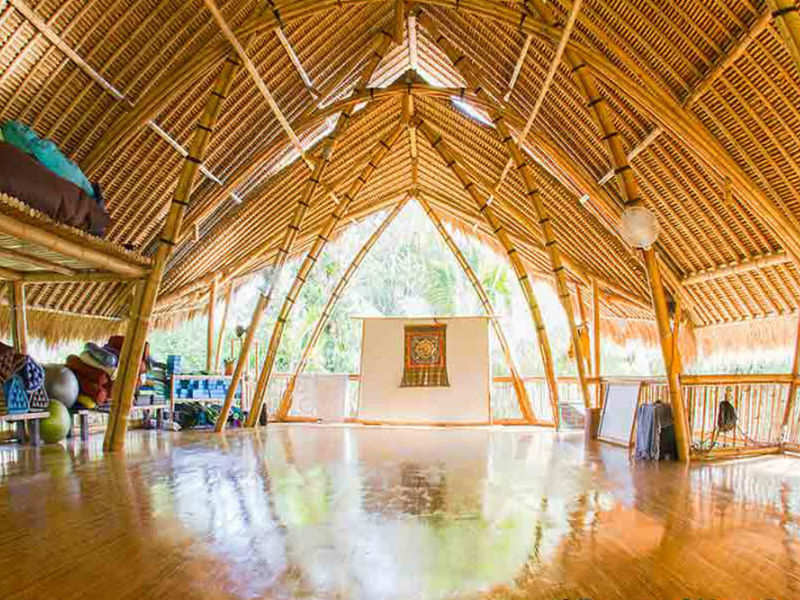
Identify the location of mattress. The image size is (800, 600). (46, 200).